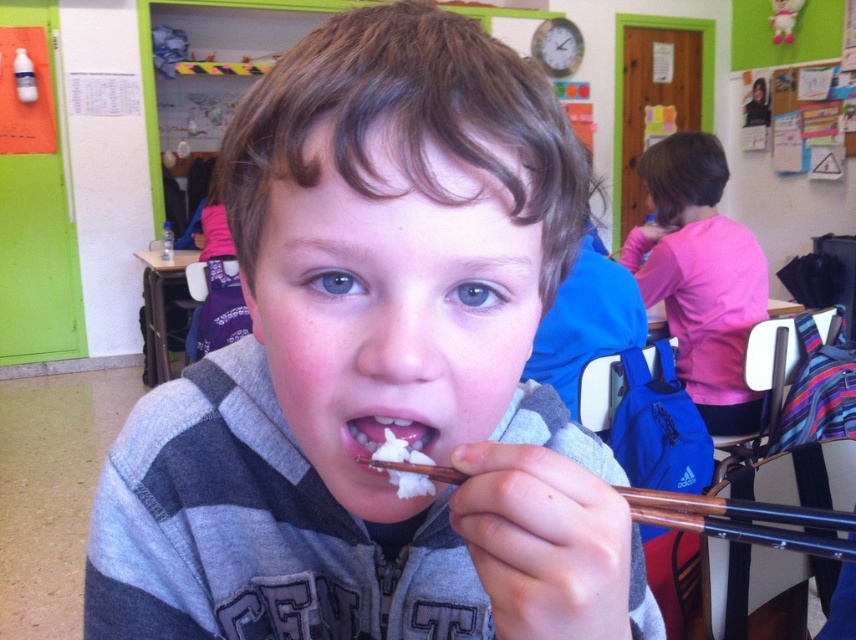
Question: Can you confirm if brown wood chopstick at lower center is wider than white fluffy rice at mouth?

Choices:
 (A) no
 (B) yes

Answer: (B)

Question: Which of the following is the closest to the observer?

Choices:
 (A) (675, 280)
 (B) (795, 536)
 (C) (351, 554)
 (D) (418, 420)

Answer: (B)

Question: Which object appears closest to the camera in this image?

Choices:
 (A) pink fabric shirt at upper right
 (B) white fluffy rice at mouth

Answer: (B)

Question: Is the position of pink fabric shirt at upper right less distant than that of brown wood chopstick at lower center?

Choices:
 (A) yes
 (B) no

Answer: (B)

Question: Is pink fabric shirt at upper right bigger than white fluffy rice at mouth?

Choices:
 (A) no
 (B) yes

Answer: (B)

Question: Which object appears farthest from the camera in this image?

Choices:
 (A) brown wood chopstick at lower center
 (B) white fluffy rice at mouth
 (C) pink fabric shirt at upper right

Answer: (C)